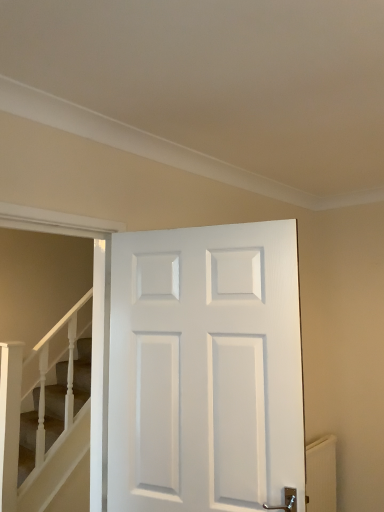
Question: In terms of height, does white matte door at center look taller or shorter compared to smooth beige carpet at lower left?

Choices:
 (A) tall
 (B) short

Answer: (B)

Question: Visually, is white matte door at center positioned to the left or to the right of smooth beige carpet at lower left?

Choices:
 (A) right
 (B) left

Answer: (A)

Question: Considering the real-world distances, which object is closest to the smooth beige carpet at lower left?

Choices:
 (A) white textured radiator at lower right
 (B) white matte door at center

Answer: (B)

Question: Based on their relative distances, which object is nearer to the white matte door at center?

Choices:
 (A) smooth beige carpet at lower left
 (B) white textured radiator at lower right

Answer: (A)